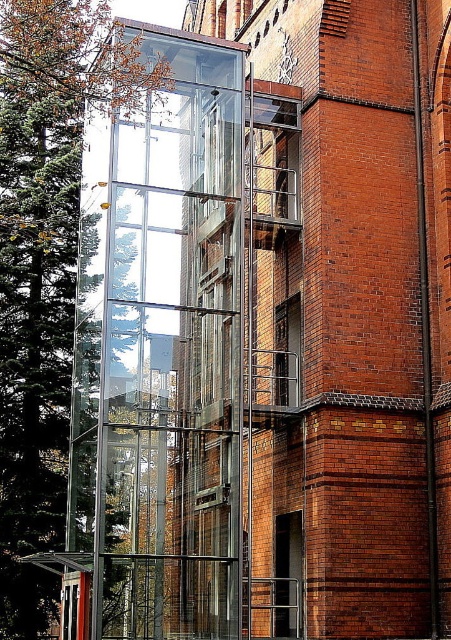
Question: Among these objects, which one is farthest from the camera?

Choices:
 (A) transparent glass elevator at center
 (B) green leafy tree at left

Answer: (B)

Question: Does transparent glass elevator at center appear on the right side of green leafy tree at left?

Choices:
 (A) no
 (B) yes

Answer: (B)

Question: Can you confirm if transparent glass elevator at center is positioned below green leafy tree at left?

Choices:
 (A) no
 (B) yes

Answer: (B)

Question: Which of the following is the closest to the observer?

Choices:
 (A) green leafy tree at left
 (B) transparent glass elevator at center

Answer: (B)

Question: Can you confirm if transparent glass elevator at center is positioned below green leafy tree at left?

Choices:
 (A) yes
 (B) no

Answer: (A)